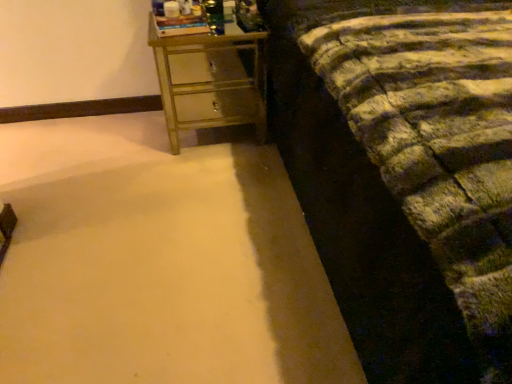
Image resolution: width=512 pixels, height=384 pixels. What are the coordinates of `vacant space situated on the left part of gold metallic chest of drawers at upper left` in the screenshot? It's located at (125, 139).